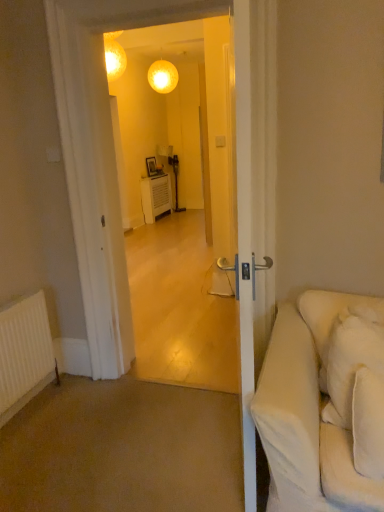
This screenshot has width=384, height=512. I want to click on vacant area that is situated to the right of white matte radiator at lower left, so click(84, 408).